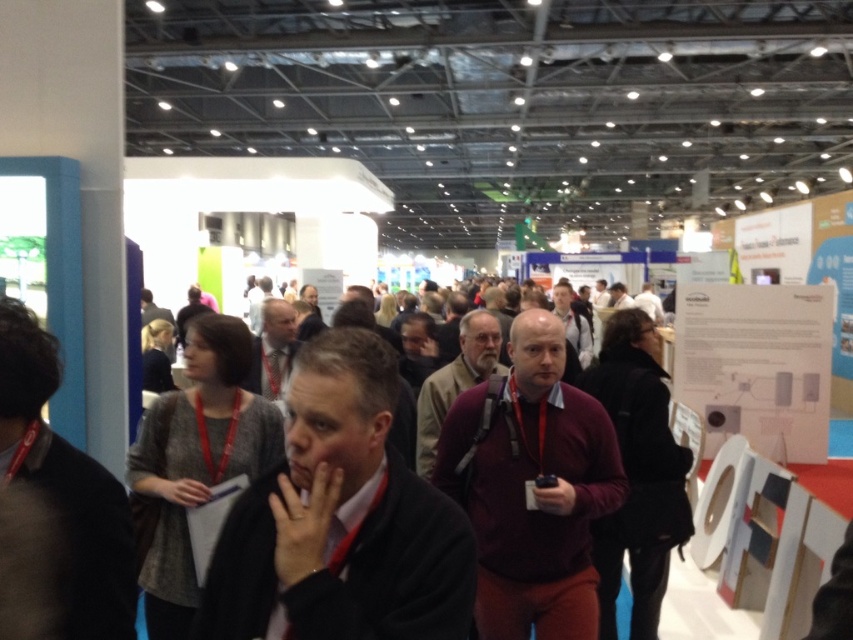
From the picture: Is matte gray suit at center in front of matte black jacket at center?

That is True.

Who is higher up, matte gray suit at center or matte black jacket at center?

matte black jacket at center is higher up.

Locate an element on the screen. This screenshot has width=853, height=640. matte gray suit at center is located at coordinates (271, 349).

Can you confirm if maroon sweater at center is smaller than dark brown leather jacket at center?

Yes.

The image size is (853, 640). In order to click on maroon sweater at center in this screenshot , I will do `click(532, 488)`.

Does black matte jacket at center lie behind dark brown leather jacket at center?

No, it is in front of dark brown leather jacket at center.

Looking at this image, who is taller, black matte jacket at center or dark brown leather jacket at center?

black matte jacket at center is taller.

Is point (437, 572) less distant than point (619, 282)?

Yes, it is.

Find the location of `black matte jacket at center`. black matte jacket at center is located at coordinates (340, 520).